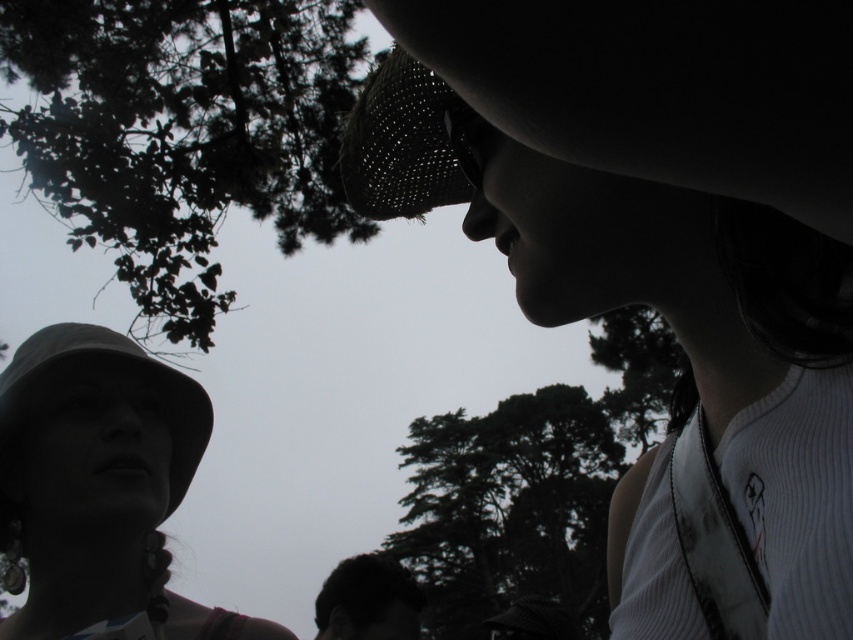
Question: Considering the real-world distances, which object is farthest from the black mesh hat at upper center?

Choices:
 (A) matte black goggles at upper center
 (B) matte white hat at upper right
 (C) dark brown hair at lower center

Answer: (C)

Question: Can you confirm if green leafy tree at upper left is positioned above dark brown hair at lower center?

Choices:
 (A) no
 (B) yes

Answer: (B)

Question: Which of the following is the farthest from the observer?

Choices:
 (A) (368, 634)
 (B) (474, 166)
 (C) (659, 202)
 (D) (173, 406)

Answer: (A)

Question: Which object is positioned farthest from the green leafy tree at center?

Choices:
 (A) dark brown hair at lower center
 (B) matte white hat at upper right

Answer: (B)

Question: Can you confirm if green leafy tree at center is smaller than dark brown hair at lower center?

Choices:
 (A) no
 (B) yes

Answer: (B)

Question: Can you confirm if matte white hat at upper right is positioned to the right of matte white hat at lower left?

Choices:
 (A) no
 (B) yes

Answer: (B)